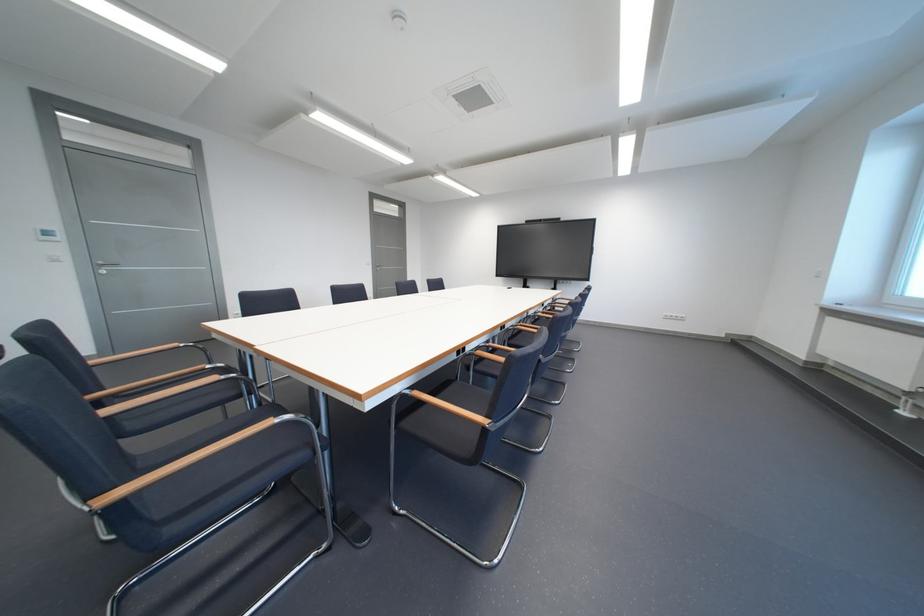
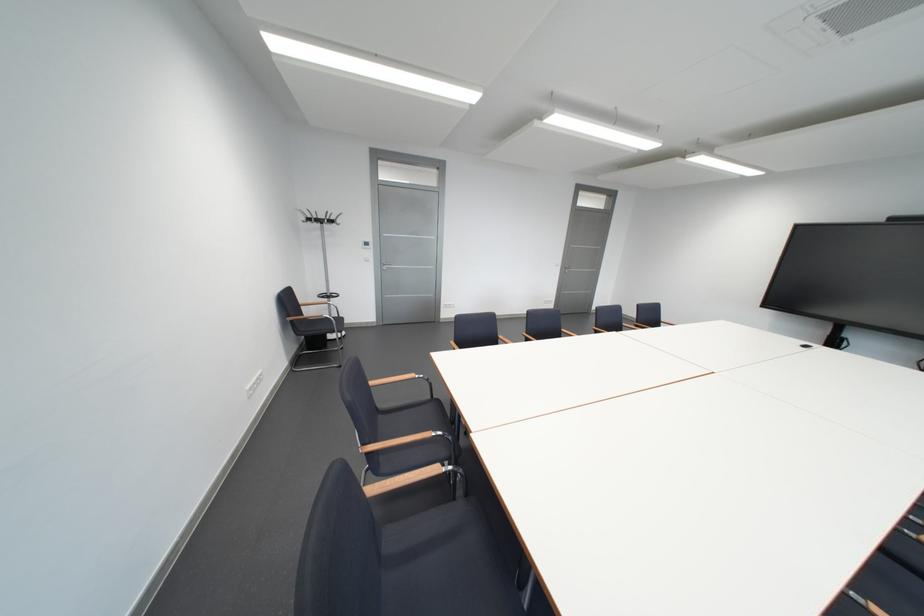
Question: The images are taken continuously from a first-person perspective. In which direction is your viewpoint rotating?

Choices:
 (A) Left
 (B) Right
 (C) Up
 (D) Down

Answer: (A)